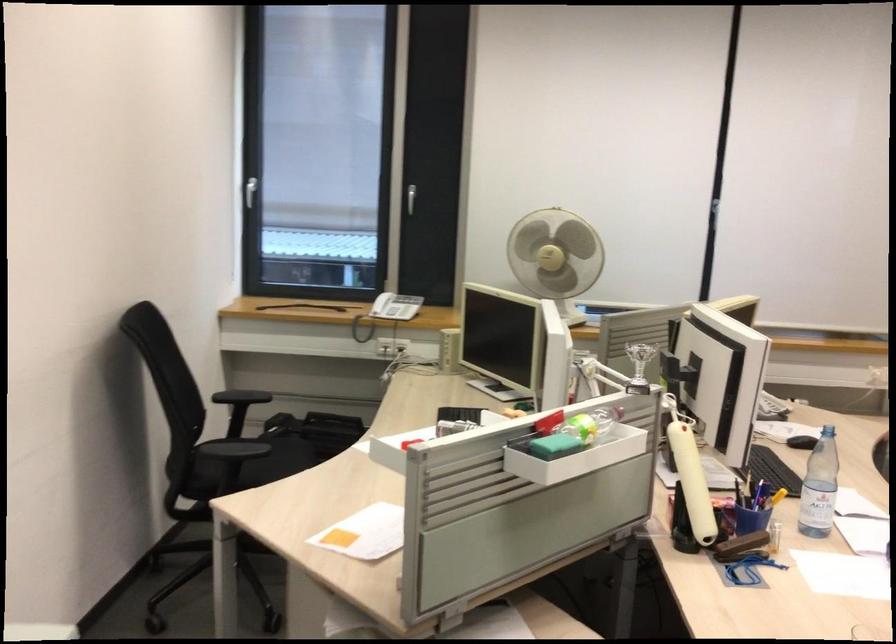
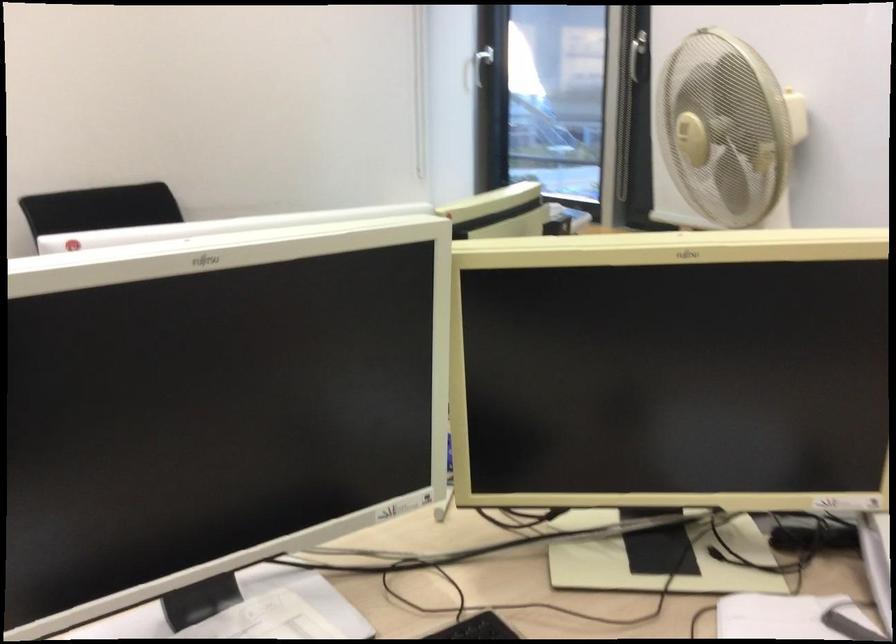
Question: I am providing you with two images of the same scene from different viewpoints. Which of the following objects are not visible in image2?

Choices:
 (A) telephone handset
 (B) fan control knob
 (C) green bottle
 (D) white window handle

Answer: (A)